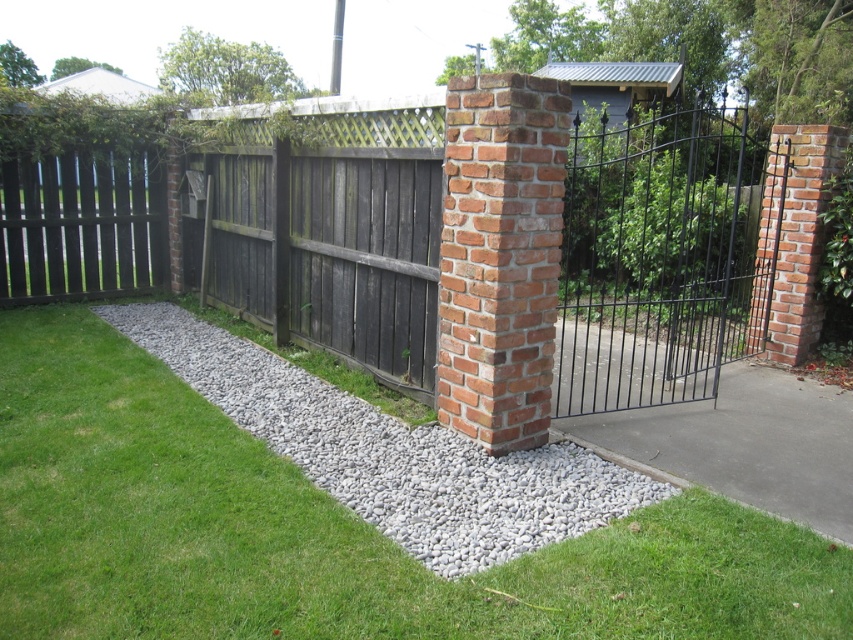
Question: Can you confirm if wooden fence at center is positioned above gray gravel at center?

Choices:
 (A) no
 (B) yes

Answer: (B)

Question: In this image, where is wooden fence at center located relative to gray gravel at center?

Choices:
 (A) below
 (B) above

Answer: (B)

Question: In this image, where is wooden fence at center located relative to gray gravel at center?

Choices:
 (A) left
 (B) right

Answer: (B)

Question: Among these objects, which one is farthest from the camera?

Choices:
 (A) red brick column at center
 (B) wooden fence at center
 (C) gray gravel at center

Answer: (B)

Question: Which object appears closest to the camera in this image?

Choices:
 (A) wooden fence at center
 (B) gray gravel at center
 (C) red brick column at center

Answer: (B)

Question: Which of the following is the closest to the observer?

Choices:
 (A) wooden fence at center
 (B) gray gravel at center

Answer: (B)